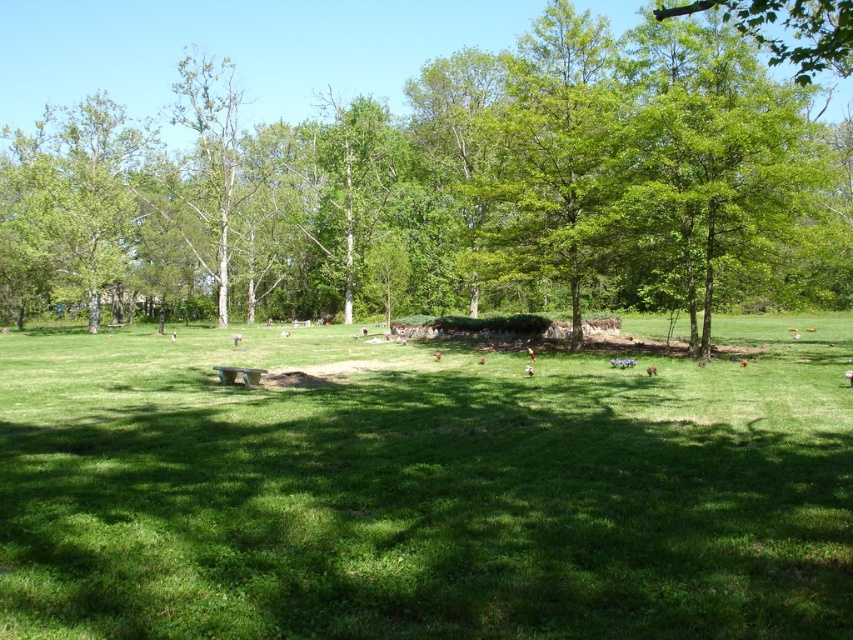
Question: Which point is farther to the camera?

Choices:
 (A) green leafy tree at upper right
 (B) green grassy area at center

Answer: (A)

Question: Which of these objects is positioned farthest from the green grassy area at center?

Choices:
 (A) green leafy tree at center
 (B) green leafy tree at upper right

Answer: (A)

Question: Does green grassy area at center lie behind green leafy tree at center?

Choices:
 (A) yes
 (B) no

Answer: (B)

Question: Is green grassy area at center to the right of green leafy tree at center from the viewer's perspective?

Choices:
 (A) yes
 (B) no

Answer: (A)

Question: Among these points, which one is farthest from the camera?

Choices:
 (A) (463, 243)
 (B) (840, 68)

Answer: (B)

Question: Can you confirm if green leafy tree at center is positioned to the right of green leafy tree at upper right?

Choices:
 (A) no
 (B) yes

Answer: (A)